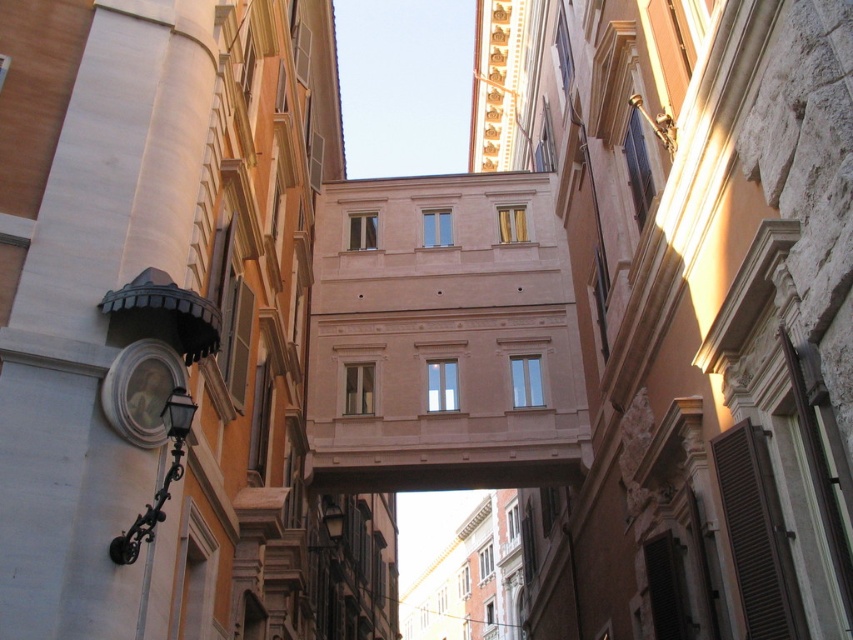
Question: Which point is farther to the camera?

Choices:
 (A) (724, 208)
 (B) (381, 385)

Answer: (B)

Question: Considering the relative positions of smooth stone wall at center and smooth beige building at center in the image provided, where is smooth stone wall at center located with respect to smooth beige building at center?

Choices:
 (A) right
 (B) left

Answer: (A)

Question: Can you confirm if smooth stone wall at center is positioned below smooth beige building at center?

Choices:
 (A) yes
 (B) no

Answer: (A)

Question: Among these objects, which one is farthest from the camera?

Choices:
 (A) smooth stone wall at center
 (B) smooth beige building at center

Answer: (B)

Question: Which object is closer to the camera taking this photo?

Choices:
 (A) smooth beige building at center
 (B) smooth stone wall at center

Answer: (B)

Question: Does smooth stone wall at center appear under smooth beige building at center?

Choices:
 (A) no
 (B) yes

Answer: (B)